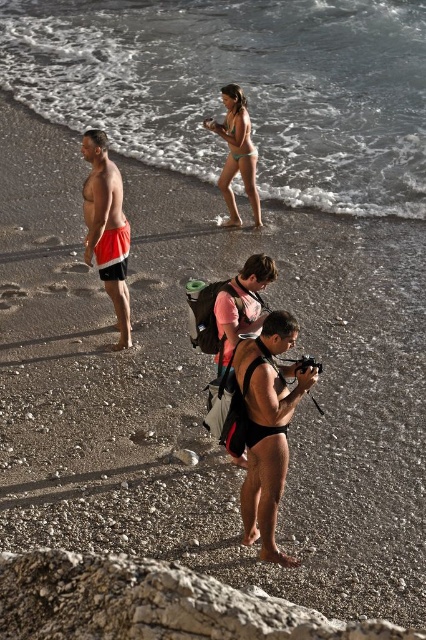
Question: Which object is farther from the camera taking this photo?

Choices:
 (A) orange fabric shorts at left
 (B) pink matte wetsuit at center
 (C) clear water at upper center
 (D) matte black swimsuit at center

Answer: (C)

Question: Which object is closer to the camera taking this photo?

Choices:
 (A) orange fabric shorts at left
 (B) matte green bikini at center
 (C) clear water at upper center
 (D) matte black swimsuit at center

Answer: (D)

Question: Does matte black swimsuit at center lie behind pink matte wetsuit at center?

Choices:
 (A) yes
 (B) no

Answer: (B)

Question: Among these objects, which one is farthest from the camera?

Choices:
 (A) orange fabric shorts at left
 (B) matte black swimsuit at center

Answer: (A)

Question: Can you confirm if matte black swimsuit at center is wider than matte green bikini at center?

Choices:
 (A) yes
 (B) no

Answer: (B)

Question: Does orange fabric shorts at left have a greater width compared to matte green bikini at center?

Choices:
 (A) no
 (B) yes

Answer: (A)